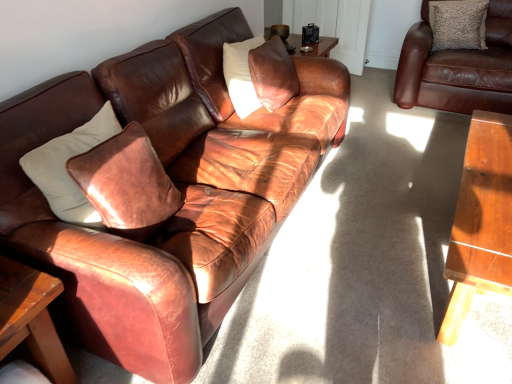
Question: Does leather pillow at center, acting as the first pillow starting from the left, have a smaller size compared to brown leather couch at upper right, which is counted as the second studio couch, starting from the left?

Choices:
 (A) no
 (B) yes

Answer: (B)

Question: Is leather pillow at center, the first pillow in the front-to-back sequence, far away from brown leather couch at upper right, which is counted as the second studio couch, starting from the left?

Choices:
 (A) no
 (B) yes

Answer: (B)

Question: From a real-world perspective, is leather pillow at center, the 2th pillow viewed from the top, positioned over brown leather couch at upper right, which is counted as the second studio couch, starting from the left, based on gravity?

Choices:
 (A) yes
 (B) no

Answer: (A)

Question: Is leather pillow at center, which ranks as the 2th pillow in right-to-left order, to the left of brown leather couch at upper right, which is counted as the second studio couch, starting from the left, from the viewer's perspective?

Choices:
 (A) no
 (B) yes

Answer: (B)

Question: From the image's perspective, is leather pillow at center, the 2th pillow viewed from the top, below brown leather couch at upper right, the first studio couch positioned from the right?

Choices:
 (A) yes
 (B) no

Answer: (A)

Question: Is wooden table at lower left to the left or to the right of textured beige pillow at upper right, arranged as the 1th pillow when viewed from the right, in the image?

Choices:
 (A) left
 (B) right

Answer: (A)

Question: Is point (8, 302) positioned closer to the camera than point (473, 24)?

Choices:
 (A) closer
 (B) farther

Answer: (A)

Question: Is wooden table at lower left spatially inside textured beige pillow at upper right, the 1th pillow viewed from the top, or outside of it?

Choices:
 (A) outside
 (B) inside

Answer: (A)

Question: From the image's perspective, is wooden table at lower left above or below textured beige pillow at upper right, which is counted as the first pillow, starting from the back?

Choices:
 (A) below
 (B) above

Answer: (A)

Question: From the image's perspective, is matte brown leather couch at left, which is the 2th studio couch in right-to-left order, above or below textured beige pillow at upper right, arranged as the 1th pillow when viewed from the right?

Choices:
 (A) below
 (B) above

Answer: (A)

Question: Is matte brown leather couch at left, which is the 2th studio couch in right-to-left order, to the left or to the right of textured beige pillow at upper right, the second pillow from the front, in the image?

Choices:
 (A) right
 (B) left

Answer: (B)

Question: From a real-world perspective, is matte brown leather couch at left, marked as the 1th studio couch in a left-to-right arrangement, above or below textured beige pillow at upper right, which is counted as the first pillow, starting from the back?

Choices:
 (A) below
 (B) above

Answer: (A)

Question: Considering the positions of matte brown leather couch at left, which is the 2th studio couch in right-to-left order, and textured beige pillow at upper right, arranged as the 1th pillow when viewed from the right, in the image, is matte brown leather couch at left, which is the 2th studio couch in right-to-left order, bigger or smaller than textured beige pillow at upper right, arranged as the 1th pillow when viewed from the right,?

Choices:
 (A) small
 (B) big

Answer: (B)

Question: Considering the positions of wooden table at lower left and brown leather couch at upper right, which is counted as the second studio couch, starting from the left, in the image, is wooden table at lower left taller or shorter than brown leather couch at upper right, which is counted as the second studio couch, starting from the left,?

Choices:
 (A) tall
 (B) short

Answer: (B)

Question: In terms of size, does wooden table at lower left appear bigger or smaller than brown leather couch at upper right, the first studio couch positioned from the right?

Choices:
 (A) big
 (B) small

Answer: (B)